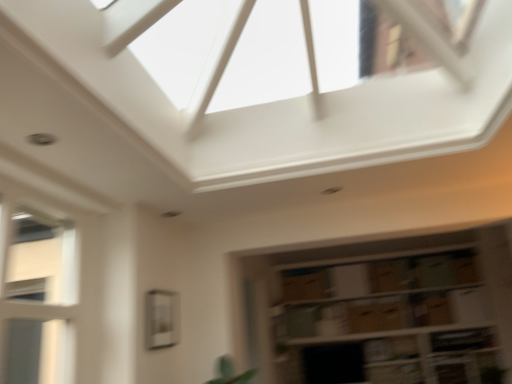
Question: Is clear glass window at center, which is the second window from left to right, positioned in front of brown cardboard boxes at lower right?

Choices:
 (A) no
 (B) yes

Answer: (B)

Question: Is clear glass window at center, marked as the second window in a front-to-back arrangement, far away from brown cardboard boxes at lower right?

Choices:
 (A) no
 (B) yes

Answer: (B)

Question: Is clear glass window at center, which is the second window from left to right, oriented away from brown cardboard boxes at lower right?

Choices:
 (A) no
 (B) yes

Answer: (A)

Question: Can you confirm if clear glass window at center, marked as the second window in a front-to-back arrangement, is wider than brown cardboard boxes at lower right?

Choices:
 (A) no
 (B) yes

Answer: (A)

Question: Does clear glass window at center, the first window from the back, appear on the right side of brown cardboard boxes at lower right?

Choices:
 (A) no
 (B) yes

Answer: (A)

Question: From a real-world perspective, is clear glass window at center, marked as the second window in a front-to-back arrangement, physically below brown cardboard boxes at lower right?

Choices:
 (A) no
 (B) yes

Answer: (A)

Question: From a real-world perspective, is brown cardboard boxes at lower right physically below white glass window at left, placed as the first window when sorted from front to back?

Choices:
 (A) no
 (B) yes

Answer: (B)

Question: Can you confirm if brown cardboard boxes at lower right is thinner than white glass window at left, marked as the second window in a right-to-left arrangement?

Choices:
 (A) no
 (B) yes

Answer: (A)

Question: Is brown cardboard boxes at lower right shorter than white glass window at left, which is counted as the 2th window, starting from the back?

Choices:
 (A) yes
 (B) no

Answer: (B)

Question: Is brown cardboard boxes at lower right completely or partially outside of white glass window at left, arranged as the first window when viewed from the left?

Choices:
 (A) no
 (B) yes

Answer: (B)

Question: Is brown cardboard boxes at lower right next to white glass window at left, marked as the second window in a right-to-left arrangement, and touching it?

Choices:
 (A) no
 (B) yes

Answer: (A)

Question: Could white glass window at left, placed as the first window when sorted from front to back, be considered to be inside brown cardboard boxes at lower right?

Choices:
 (A) no
 (B) yes

Answer: (A)

Question: Is there a large distance between clear glass window at center, which ranks as the first window in right-to-left order, and white glass window at left, arranged as the first window when viewed from the left?

Choices:
 (A) no
 (B) yes

Answer: (A)